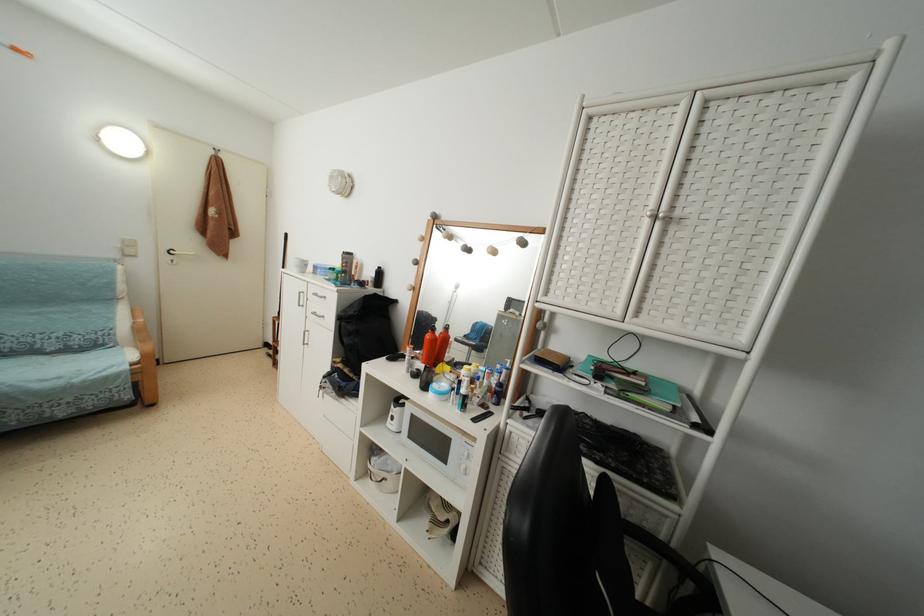
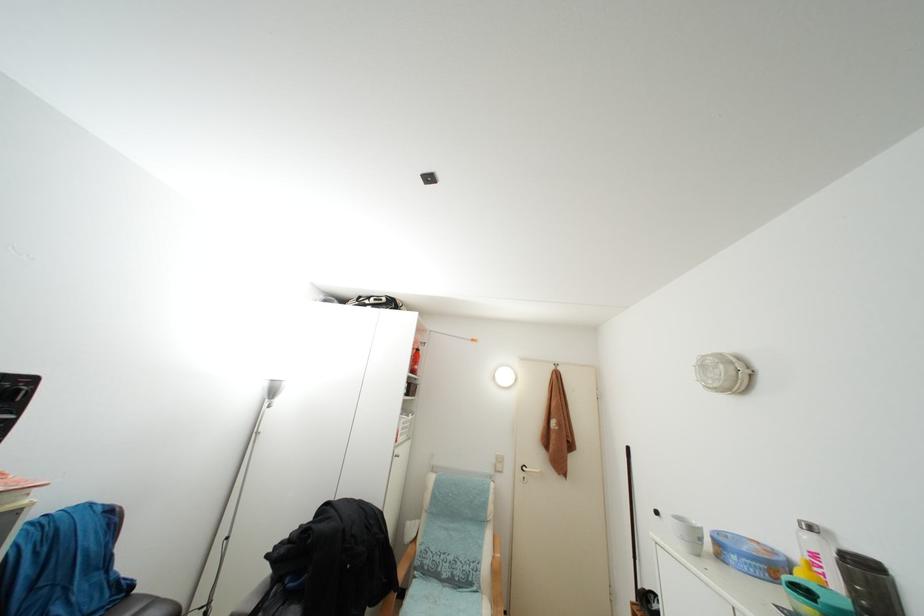
How did the camera likely rotate?

The rotation direction of the camera is left-up.